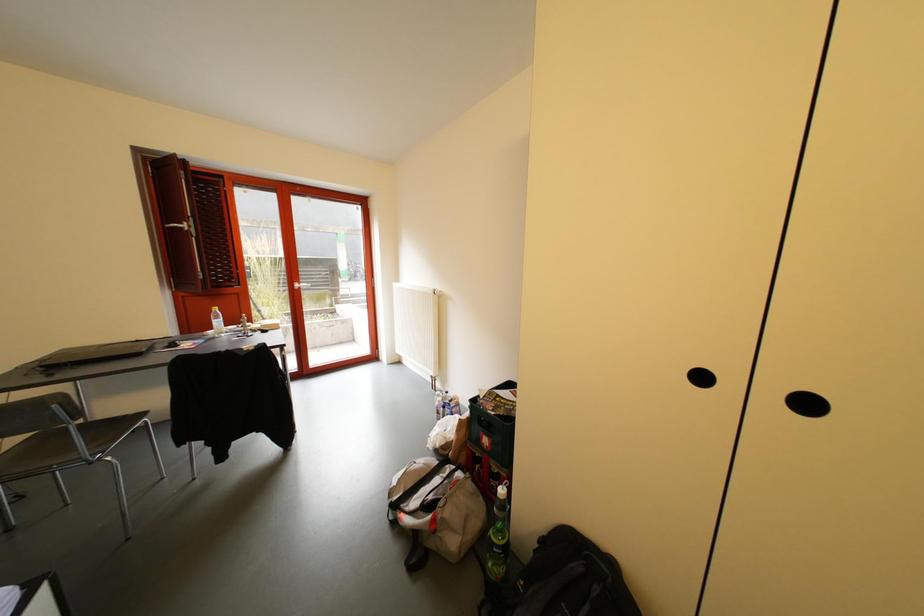
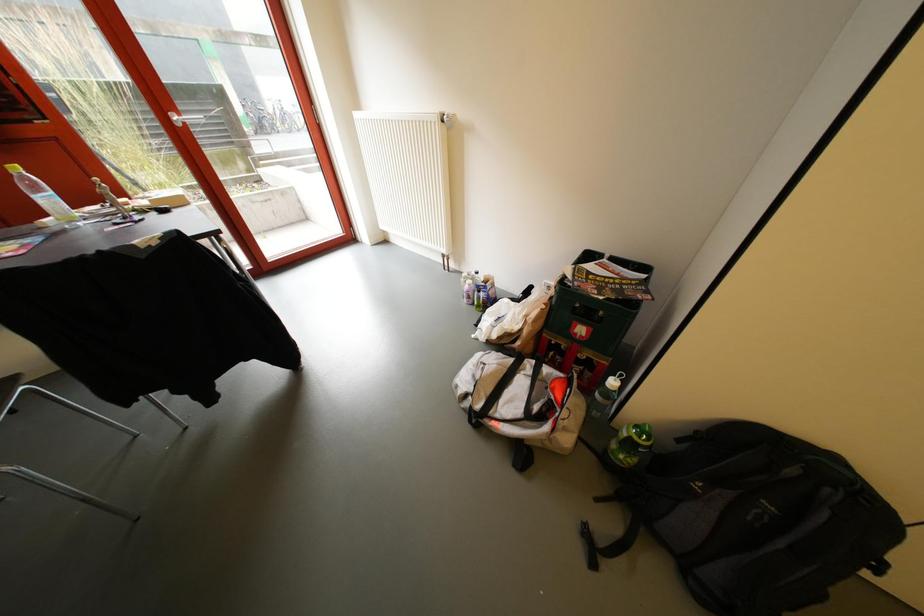
Question: Based on the continuous images, in which direction is the camera rotating? Reply with the corresponding letter.

Choices:
 (A) Left
 (B) Right
 (C) Up
 (D) Down

Answer: (D)